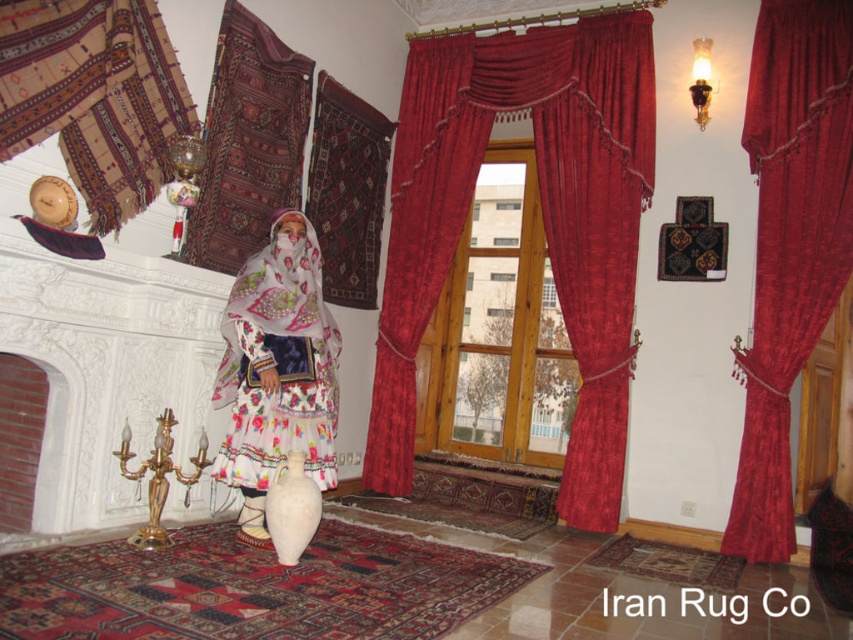
Question: Is textured woolen rug at upper left wider than floral cotton dress at center?

Choices:
 (A) yes
 (B) no

Answer: (B)

Question: Based on their relative distances, which object is farther from the velvet curtains at center?

Choices:
 (A) floral cotton dress at center
 (B) textured woolen rug at upper left
 (C) dark brown woven rug at upper left

Answer: (B)

Question: Which of the following is the farthest from the observer?

Choices:
 (A) (312, 372)
 (B) (598, 173)

Answer: (B)

Question: Which object appears farthest from the camera in this image?

Choices:
 (A) velvet red curtain at right
 (B) dark brown woven rug at upper left
 (C) textured woolen rug at upper left

Answer: (A)

Question: Does textured woolen rug at upper left appear on the left side of floral cotton dress at center?

Choices:
 (A) yes
 (B) no

Answer: (A)

Question: Is velvet red curtain at right in front of floral cotton dress at center?

Choices:
 (A) yes
 (B) no

Answer: (B)